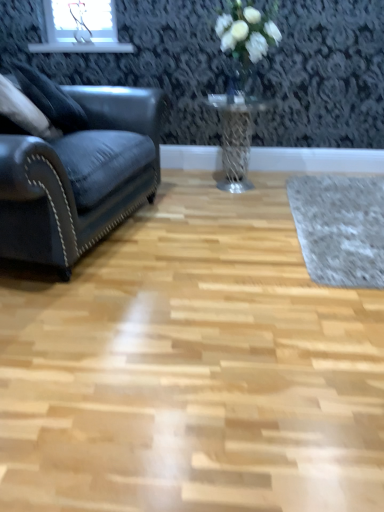
This screenshot has height=512, width=384. I want to click on velvet dark blue couch at left, so click(79, 174).

The image size is (384, 512). Find the location of `light wood floor at center`. light wood floor at center is located at coordinates (191, 367).

Measure the distance between suede-like dark blue pillow at left and camera.

The distance of suede-like dark blue pillow at left from camera is 7.53 feet.

You are a GUI agent. You are given a task and a screenshot of the screen. Output one action in this format:
    pyautogui.click(x=<x>, y=<y>)
    Task: Click on the clear glass vase at upper center
    
    Given the screenshot: What is the action you would take?
    pyautogui.click(x=235, y=90)

Which is behind, point (368, 248) or point (249, 32)?

The point (249, 32) is farther from the camera.

Is there a large distance between gray woolen mat at right and white matte vase at upper center?

That's right, there is a large distance between gray woolen mat at right and white matte vase at upper center.

The height and width of the screenshot is (512, 384). In order to click on flower above the gray woolen mat at right (from the image's perspective) in this screenshot , I will do `click(247, 31)`.

From the image's perspective, is gray woolen mat at right positioned above or below white matte vase at upper center?

gray woolen mat at right is situated lower than white matte vase at upper center in the image.

Considering the sizes of objects gray woolen mat at right and light wood floor at center in the image provided, who is bigger, gray woolen mat at right or light wood floor at center?

Bigger between the two is light wood floor at center.

Who is more distant, gray woolen mat at right or light wood floor at center?

gray woolen mat at right is behind.

From the picture: Is gray woolen mat at right to the right of light wood floor at center from the viewer's perspective?

Yes, gray woolen mat at right is to the right of light wood floor at center.

Can you see gray woolen mat at right touching light wood floor at center?

No, gray woolen mat at right is not making contact with light wood floor at center.

Does white matte vase at upper center lie behind velvet dark blue couch at left?

That is True.

Who is smaller, white matte vase at upper center or velvet dark blue couch at left?

white matte vase at upper center is smaller.

Is white matte vase at upper center facing towards velvet dark blue couch at left?

No, white matte vase at upper center is not turned towards velvet dark blue couch at left.

Considering the points (232, 12) and (84, 208), which point is in front, point (232, 12) or point (84, 208)?

Positioned in front is point (84, 208).

Find the location of a particular element. The image size is (384, 512). flower that is on the right side of clear glass vase at upper center is located at coordinates (247, 31).

Is white matte vase at upper center facing away from clear glass vase at upper center?

No.

In the scene shown: Is white matte vase at upper center taller than clear glass vase at upper center?

Yes, white matte vase at upper center is taller than clear glass vase at upper center.

Is gray woolen mat at right thinner than velvet dark blue couch at left?

In fact, gray woolen mat at right might be wider than velvet dark blue couch at left.

From a real-world perspective, which object stands above the other?

From a 3D spatial view, velvet dark blue couch at left is above.

Which is farther, [374,194] or [128,134]?

The point [374,194] is more distant.

Based on their positions, is gray woolen mat at right located to the left or right of velvet dark blue couch at left?

gray woolen mat at right is positioned on velvet dark blue couch at left's right side.

How many degrees apart are the facing directions of light wood floor at center and clear glass vase at upper center?

91.9 degrees.

From a real-world perspective, is light wood floor at center positioned over clear glass vase at upper center based on gravity?

No, from a real-world perspective, light wood floor at center is not above clear glass vase at upper center.

Is light wood floor at center thinner than clear glass vase at upper center?

No, light wood floor at center is not thinner than clear glass vase at upper center.

Would you say light wood floor at center contains clear glass vase at upper center?

No, clear glass vase at upper center is not a part of light wood floor at center.

From the picture: What's the angular difference between suede-like dark blue pillow at left and velvet dark blue couch at left's facing directions?

suede-like dark blue pillow at left and velvet dark blue couch at left are facing 0.00057 degrees away from each other.

Considering the sizes of objects suede-like dark blue pillow at left and velvet dark blue couch at left in the image provided, who is taller, suede-like dark blue pillow at left or velvet dark blue couch at left?

velvet dark blue couch at left.

In the scene shown: Is suede-like dark blue pillow at left looking in the opposite direction of velvet dark blue couch at left?

Yes, suede-like dark blue pillow at left is positioned with its back facing velvet dark blue couch at left.

Relative to velvet dark blue couch at left, is suede-like dark blue pillow at left in front or behind?

Visually, suede-like dark blue pillow at left is located behind velvet dark blue couch at left.

Image resolution: width=384 pixels, height=512 pixels. Find the location of `mat below the white matte vase at upper center (from the image's perspective)`. mat below the white matte vase at upper center (from the image's perspective) is located at coordinates (340, 228).

Locate an element on the screen. This screenshot has height=512, width=384. mat above the light wood floor at center (from the image's perspective) is located at coordinates (340, 228).

Based on their spatial positions, is suede-like dark blue pillow at left or light wood floor at center further from metallic mesh table at center?

light wood floor at center is positioned further to the anchor metallic mesh table at center.

From the image, which object appears to be nearer to suede-like dark blue pillow at left, light wood floor at center or gray woolen mat at right?

light wood floor at center is positioned closer to the anchor suede-like dark blue pillow at left.

Based on the photo, from the image, which object appears to be farther from light wood floor at center, clear glass vase at upper center or white matte vase at upper center?

clear glass vase at upper center.

Considering their positions, is metallic mesh table at center positioned closer to light wood floor at center than clear glass vase at upper center?

metallic mesh table at center lies closer to light wood floor at center than the other object.

When comparing their distances from gray woolen mat at right, does light wood floor at center or velvet dark blue couch at left seem further?

velvet dark blue couch at left.

Looking at this image, when comparing their distances from velvet dark blue couch at left, does white matte vase at upper center or clear glass vase at upper center seem closer?

white matte vase at upper center is positioned closer to the anchor velvet dark blue couch at left.

From the image, which object appears to be farther from clear glass vase at upper center, light wood floor at center or white matte vase at upper center?

The object further to clear glass vase at upper center is light wood floor at center.

Estimate the real-world distances between objects in this image. Which object is further from suede-like dark blue pillow at left, metallic mesh table at center or light wood floor at center?

light wood floor at center is further to suede-like dark blue pillow at left.

This screenshot has width=384, height=512. I want to click on flower between light wood floor at center and metallic mesh table at center along the z-axis, so click(x=247, y=31).

I want to click on table situated between suede-like dark blue pillow at left and clear glass vase at upper center from left to right, so [236, 138].

Find the location of `pillow between light wood floor at center and clear glass vase at upper center along the z-axis`. pillow between light wood floor at center and clear glass vase at upper center along the z-axis is located at coordinates tap(50, 99).

Where is `glass vase between velvet dark blue couch at left and white matte vase at upper center in the horizontal direction`? The image size is (384, 512). glass vase between velvet dark blue couch at left and white matte vase at upper center in the horizontal direction is located at coordinates (235, 90).